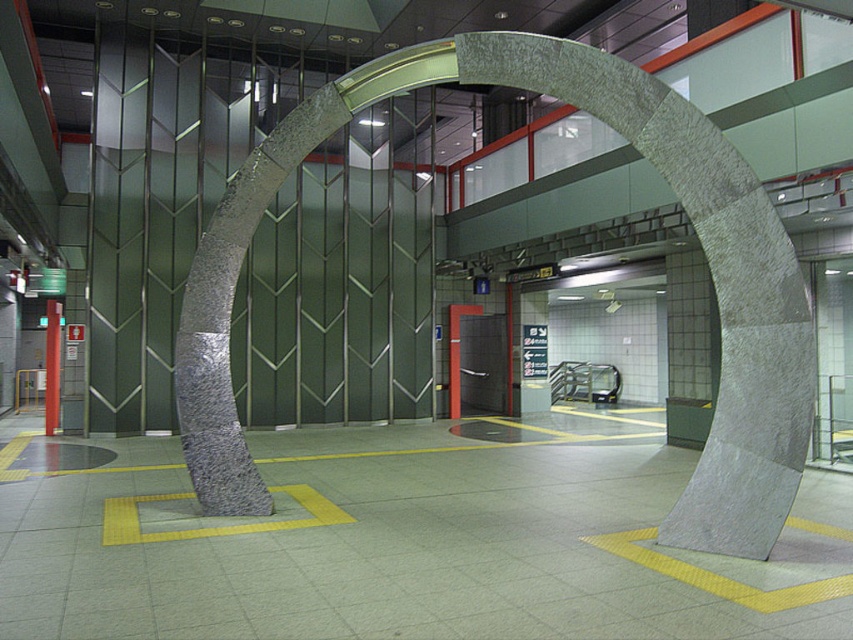
Question: Among these objects, which one is farthest from the camera?

Choices:
 (A) metallic pole at left
 (B) gray stone arch at center

Answer: (A)

Question: Among these objects, which one is farthest from the camera?

Choices:
 (A) metallic pole at left
 (B) gray stone arch at center

Answer: (A)

Question: Is the position of gray stone arch at center less distant than that of metallic pole at left?

Choices:
 (A) yes
 (B) no

Answer: (A)

Question: Does gray stone arch at center appear on the right side of metallic pole at left?

Choices:
 (A) no
 (B) yes

Answer: (B)

Question: Is gray stone arch at center thinner than metallic pole at left?

Choices:
 (A) yes
 (B) no

Answer: (B)

Question: Which of the following is the closest to the observer?

Choices:
 (A) click(218, 513)
 (B) click(45, 384)

Answer: (A)